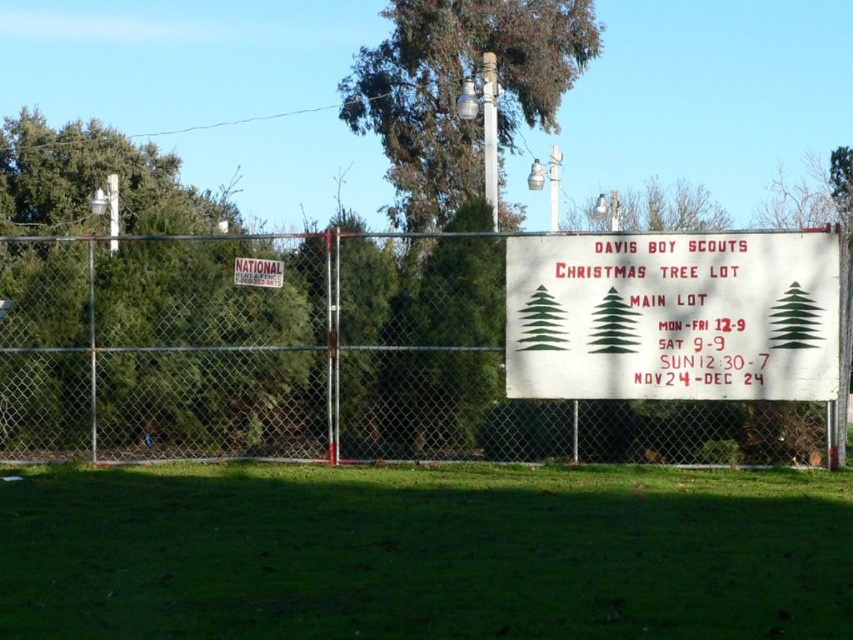
Between green grass at lower center and white plastic sign at upper center, which one is positioned higher?

white plastic sign at upper center is higher up.

Looking at this image, who is positioned more to the right, green grass at lower center or white plastic sign at upper center?

From the viewer's perspective, green grass at lower center appears more on the right side.

Where is `green grass at lower center`? Image resolution: width=853 pixels, height=640 pixels. green grass at lower center is located at coordinates (424, 554).

Image resolution: width=853 pixels, height=640 pixels. What are the coordinates of `green grass at lower center` in the screenshot? It's located at (424, 554).

Which is in front, point (537, 29) or point (277, 285)?

Point (277, 285) is in front.

Between green leafy tree at upper center and white plastic sign at upper center, which one has less height?

white plastic sign at upper center is shorter.

Identify the location of green leafy tree at upper center. Image resolution: width=853 pixels, height=640 pixels. (460, 92).

Locate an element on the screen. green leafy tree at upper center is located at coordinates (460, 92).

Is green grass at lower center taller than green leafy tree at upper center?

No.

What do you see at coordinates (424, 554) in the screenshot? I see `green grass at lower center` at bounding box center [424, 554].

In order to click on green grass at lower center in this screenshot , I will do `click(424, 554)`.